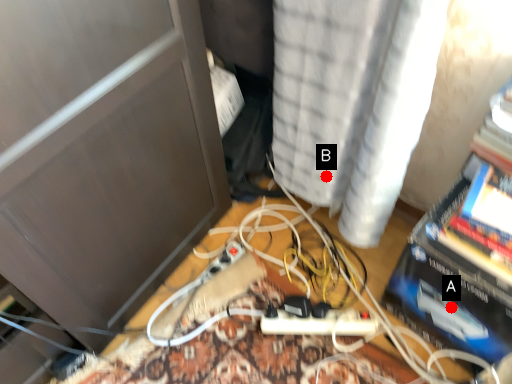
Question: Two points are circled on the image, labeled by A and B beside each circle. Which point appears closest to the camera in this image?

Choices:
 (A) A is closer
 (B) B is closer

Answer: (A)